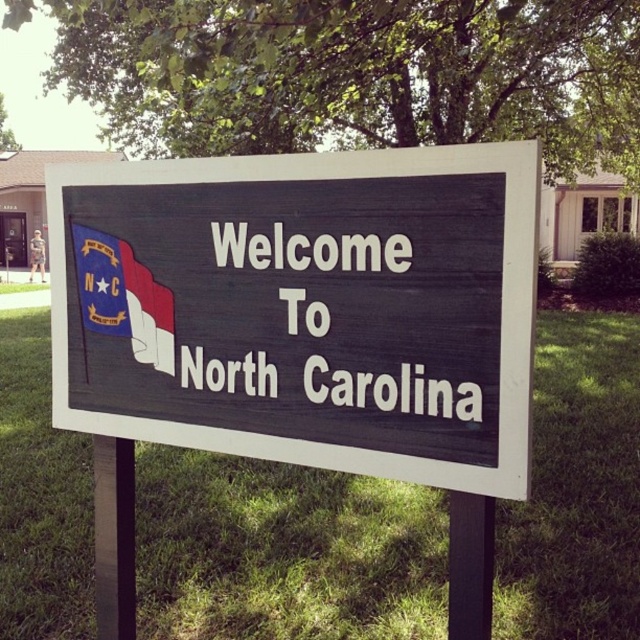
Is dark wood sign at center further to camera compared to green grass at center?

No.

This screenshot has height=640, width=640. Identify the location of dark wood sign at center. (305, 308).

Find the location of a particular element. dark wood sign at center is located at coordinates (305, 308).

Who is taller, dark wood sign at center or matte red flag at upper left?

dark wood sign at center

Can you confirm if dark wood sign at center is smaller than matte red flag at upper left?

Actually, dark wood sign at center might be larger than matte red flag at upper left.

Is point (435, 157) positioned in front of point (170, 310)?

Yes, it is.

The height and width of the screenshot is (640, 640). I want to click on dark wood sign at center, so click(305, 308).

Between green grass at center and matte red flag at upper left, which one is positioned higher?

matte red flag at upper left is above.

Who is positioned more to the right, green grass at center or matte red flag at upper left?

Positioned to the right is green grass at center.

Between point (188, 611) and point (170, 356), which one is positioned behind?

The point (188, 611) is more distant.

The width and height of the screenshot is (640, 640). In order to click on green grass at center in this screenshot , I will do `click(284, 552)`.